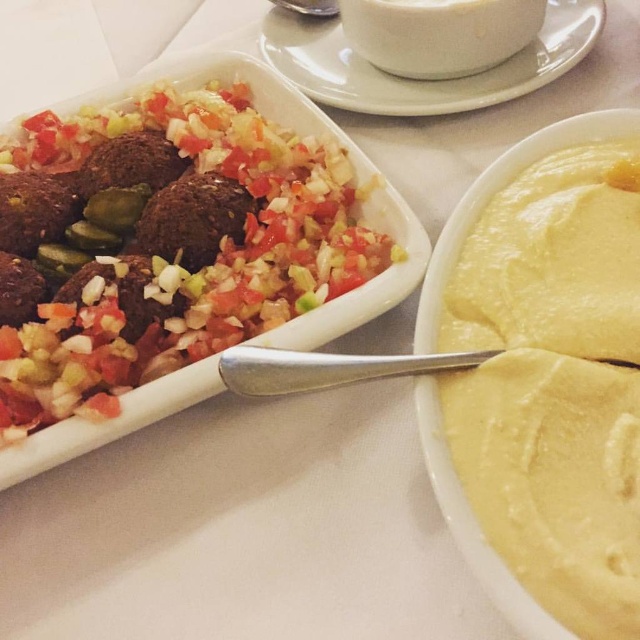
Question: Which point is closer to the camera taking this photo?

Choices:
 (A) (x=360, y=76)
 (B) (x=104, y=298)
 (C) (x=490, y=268)

Answer: (C)

Question: Which object is positioned farthest from the yellow smooth hummus at right?

Choices:
 (A) white ceramic cup at upper center
 (B) matte brown meatballs at left

Answer: (A)

Question: Is yellow smooth hummus at right bigger than white ceramic cup at upper center?

Choices:
 (A) no
 (B) yes

Answer: (A)

Question: Does matte brown meatballs at left have a smaller size compared to yellow smooth hummus at right?

Choices:
 (A) yes
 (B) no

Answer: (B)

Question: Among these objects, which one is farthest from the camera?

Choices:
 (A) yellow smooth hummus at right
 (B) white ceramic cup at upper center
 (C) matte brown meatballs at left

Answer: (B)

Question: Does yellow smooth hummus at right lie in front of white ceramic cup at upper center?

Choices:
 (A) yes
 (B) no

Answer: (A)